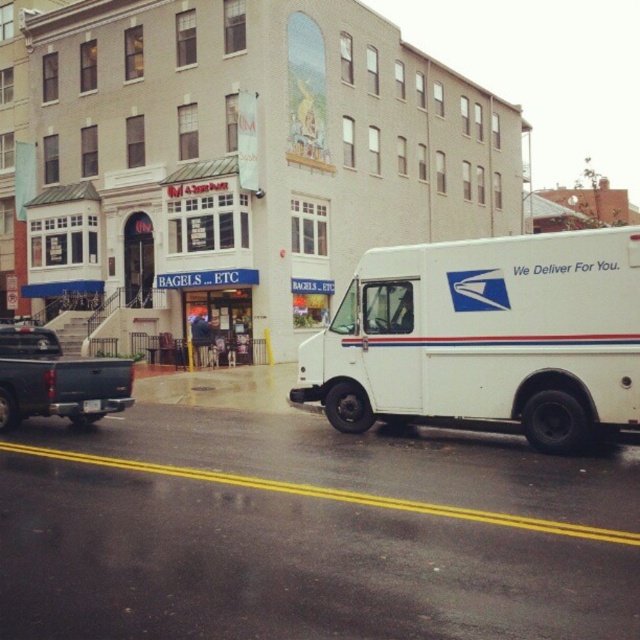
You are a delivery person who needs to park a new vehicle between the matte black truck at left and the white plastic license plate at center. Based on their heights, which side should you park closer to ensure the vehicle doesn

The matte black truck at left is much taller than the white plastic license plate at center. To ensure the vehicle can fit between them, you should park closer to the white plastic license plate at center since it is shorter.

You are a delivery person trying to locate the postal van. From your current position, which object is closer to you between the white matte postal van at right and the white plastic license plate at center?

The white plastic license plate at center is closer to you since the white matte postal van at right is positioned on the right side of it, meaning the van is further away from your current position.

You are a pedestrian standing on the sidewalk and want to take a photo of the white matte postal van at right and the white plastic license plate at center. Which object should you focus on first to ensure both are in the frame without moving the camera?

You should focus on the white plastic license plate at center first because the white matte postal van at right is farther away, so by focusing on the closer object, both will be in focus.